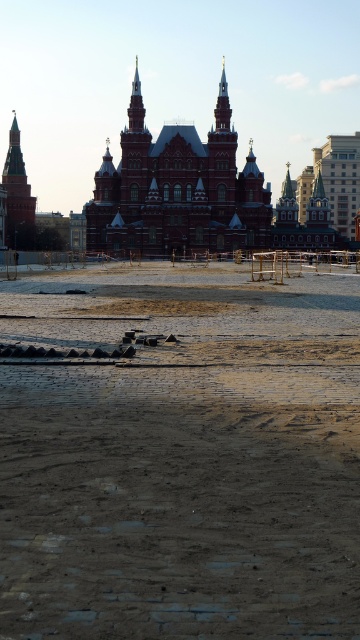
Is point (92, 563) closer to camera compared to point (243, 204)?

That is True.

How far apart are brown sandy ground at center and red brick building at center?

The distance of brown sandy ground at center from red brick building at center is 26.68 meters.

Locate an element on the screen. brown sandy ground at center is located at coordinates point(181,456).

You are a GUI agent. You are given a task and a screenshot of the screen. Output one action in this format:
    pyautogui.click(x=<x>, y=<y>)
    Task: Click on the brown sandy ground at center
    The image size is (360, 640).
    Given the screenshot: What is the action you would take?
    pyautogui.click(x=181, y=456)

The width and height of the screenshot is (360, 640). What do you see at coordinates (181, 456) in the screenshot?
I see `brown sandy ground at center` at bounding box center [181, 456].

Which is in front, point (204, 337) or point (28, 204)?

Point (204, 337)

Is point (219, 595) behind point (29, 227)?

No.

Locate an element on the screen. This screenshot has height=640, width=360. brown sandy ground at center is located at coordinates (181, 456).

Can you confirm if red brick building at center is thinner than brick tower at left?

No.

Is red brick building at center positioned before brick tower at left?

Yes, red brick building at center is in front of brick tower at left.

Describe the element at coordinates (177, 188) in the screenshot. I see `red brick building at center` at that location.

I want to click on red brick building at center, so click(177, 188).